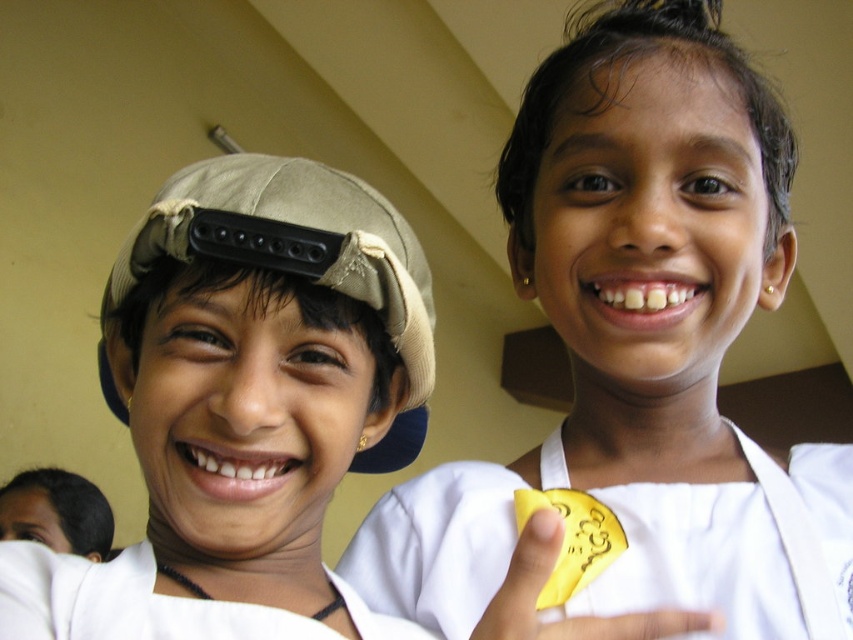
Who is lower down, gold shiny coin at upper right or matte beige cap at left?

matte beige cap at left is lower down.

Can you confirm if gold shiny coin at upper right is thinner than matte beige cap at left?

No.

You are a GUI agent. You are given a task and a screenshot of the screen. Output one action in this format:
    pyautogui.click(x=<x>, y=<y>)
    Task: Click on the gold shiny coin at upper right
    This screenshot has height=640, width=853.
    Given the screenshot: What is the action you would take?
    point(636,365)

This screenshot has height=640, width=853. What are the coordinates of `gold shiny coin at upper right` in the screenshot? It's located at (636, 365).

Is matte beige cap at left to the right of beige fabric baseball hat at left from the viewer's perspective?

Correct, you'll find matte beige cap at left to the right of beige fabric baseball hat at left.

Measure the distance from matte beige cap at left to beige fabric baseball hat at left.

A distance of 1.42 inches exists between matte beige cap at left and beige fabric baseball hat at left.

Which is behind, point (238, 424) or point (189, 212)?

The point (189, 212) is more distant.

This screenshot has height=640, width=853. I want to click on matte beige cap at left, so click(x=247, y=406).

Is gold shiny coin at upper right further to the viewer compared to beige fabric baseball hat at left?

No, gold shiny coin at upper right is closer to the viewer.

Is point (587, 321) farther from camera compared to point (229, 252)?

Yes.

Locate an element on the screen. The width and height of the screenshot is (853, 640). gold shiny coin at upper right is located at coordinates (636, 365).